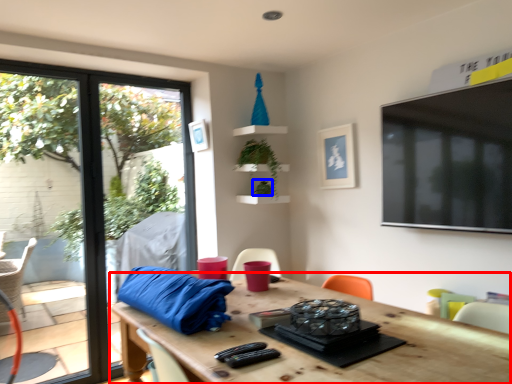
Question: Which object appears closest to the camera in this image, table (highlighted by a red box) or plant (highlighted by a blue box)?

Choices:
 (A) table
 (B) plant

Answer: (A)